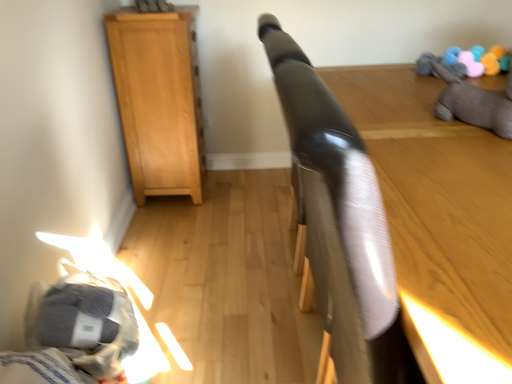
Question: From a real-world perspective, is gray plush toy at upper right positioned over light brown wood cabinet at left, marked as the 1th furniture in a back-to-front arrangement, based on gravity?

Choices:
 (A) no
 (B) yes

Answer: (B)

Question: From the image's perspective, is gray plush toy at upper right on top of light brown wood cabinet at left, the 1th furniture from the left?

Choices:
 (A) no
 (B) yes

Answer: (A)

Question: Does gray plush toy at upper right turn towards light brown wood cabinet at left, marked as the 1th furniture in a back-to-front arrangement?

Choices:
 (A) no
 (B) yes

Answer: (A)

Question: Can you confirm if gray plush toy at upper right is smaller than light brown wood cabinet at left, the 2th furniture when ordered from front to back?

Choices:
 (A) no
 (B) yes

Answer: (B)

Question: Is gray plush toy at upper right positioned behind light brown wood cabinet at left, marked as the 1th furniture in a back-to-front arrangement?

Choices:
 (A) yes
 (B) no

Answer: (B)

Question: Looking at their shapes, would you say gray fabric bed at lower left is wider or thinner than glossy black headboard at upper center, which ranks as the 2th furniture in left-to-right order?

Choices:
 (A) thin
 (B) wide

Answer: (A)

Question: Looking at the image, does gray fabric bed at lower left seem bigger or smaller compared to glossy black headboard at upper center, the first furniture viewed from the front?

Choices:
 (A) big
 (B) small

Answer: (B)

Question: Based on their positions, is gray fabric bed at lower left located to the left or right of glossy black headboard at upper center, the first furniture viewed from the front?

Choices:
 (A) left
 (B) right

Answer: (A)

Question: From the image's perspective, relative to glossy black headboard at upper center, the first furniture viewed from the front, is gray fabric bed at lower left above or below?

Choices:
 (A) above
 (B) below

Answer: (B)

Question: Choose the correct answer: Is light brown wood cabinet at left, the second furniture positioned from the right, inside gray fabric bed at lower left or outside it?

Choices:
 (A) inside
 (B) outside

Answer: (B)

Question: In terms of height, does light brown wood cabinet at left, the 2th furniture when ordered from front to back, look taller or shorter compared to gray fabric bed at lower left?

Choices:
 (A) short
 (B) tall

Answer: (B)

Question: From the image's perspective, is light brown wood cabinet at left, the second furniture positioned from the right, positioned above or below gray fabric bed at lower left?

Choices:
 (A) above
 (B) below

Answer: (A)

Question: Visually, is light brown wood cabinet at left, marked as the 1th furniture in a back-to-front arrangement, positioned to the left or to the right of gray fabric bed at lower left?

Choices:
 (A) left
 (B) right

Answer: (A)

Question: Is point (420, 64) positioned closer to the camera than point (443, 244)?

Choices:
 (A) closer
 (B) farther

Answer: (B)

Question: Visually, is soft woolen balls at upper right positioned to the left or to the right of glossy black headboard at upper center, the 1th furniture when ordered from right to left?

Choices:
 (A) right
 (B) left

Answer: (A)